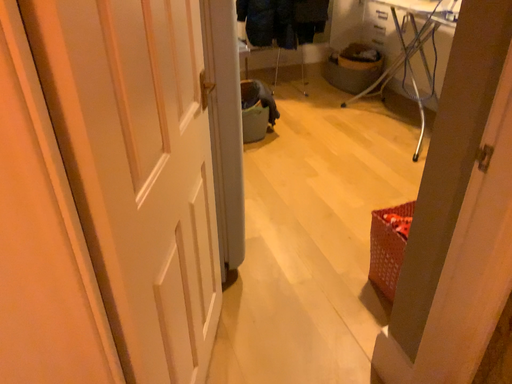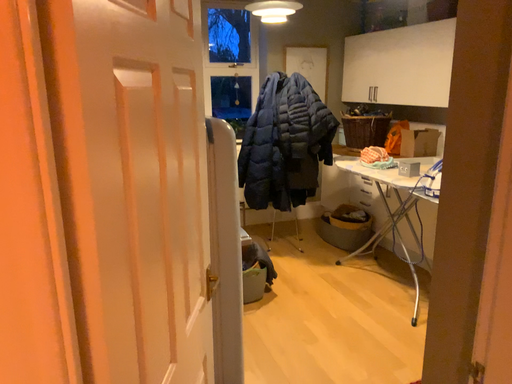
Question: Which way did the camera rotate in the video?

Choices:
 (A) rotated downward
 (B) rotated upward

Answer: (B)